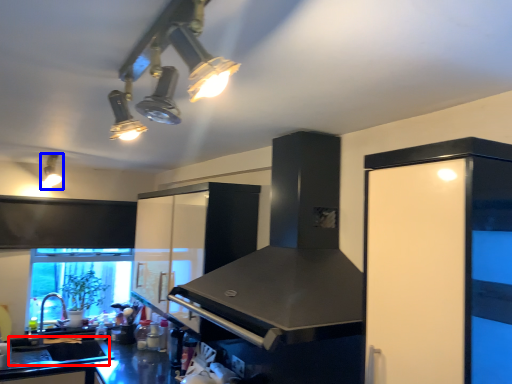
Question: Which object appears farthest to the camera in this image, sink (highlighted by a red box) or light fixture (highlighted by a blue box)?

Choices:
 (A) sink
 (B) light fixture

Answer: (A)